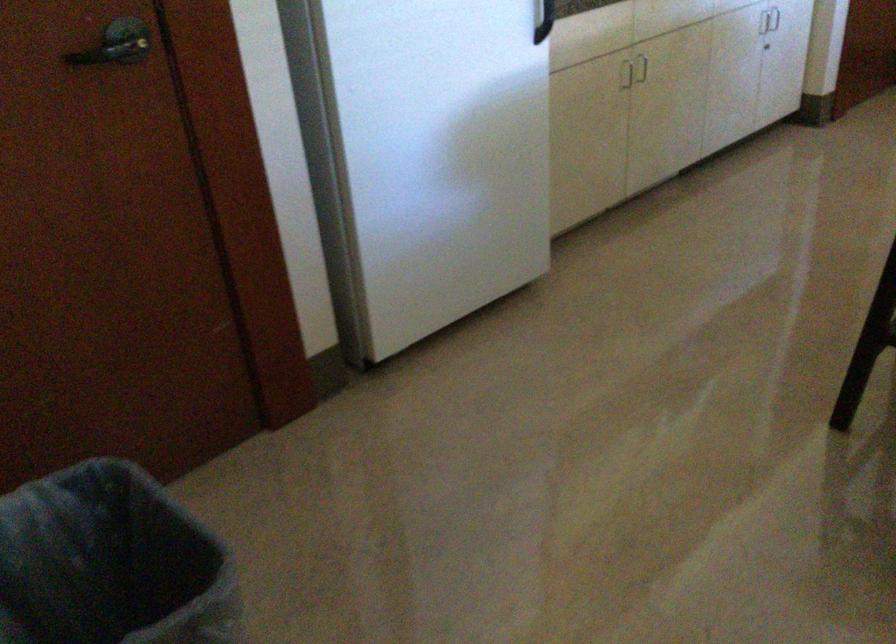
I want to click on refrigerator handle, so click(x=543, y=20).